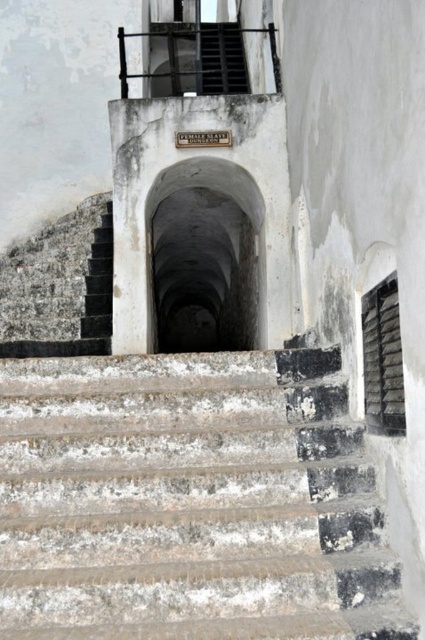
Question: Considering the real-world distances, which object is closest to the rusty metal stairs at center?

Choices:
 (A) worn concrete stairs at center
 (B) black metal balustrade at upper center

Answer: (A)

Question: Can you confirm if worn concrete stairs at center is positioned to the left of rusty metal stairs at center?

Choices:
 (A) no
 (B) yes

Answer: (B)

Question: Is worn concrete stairs at center smaller than black metal balustrade at upper center?

Choices:
 (A) yes
 (B) no

Answer: (A)

Question: Which point is farther to the camera?

Choices:
 (A) (176, 92)
 (B) (379, 572)

Answer: (A)

Question: Does worn concrete stairs at center appear under rusty metal stairs at center?

Choices:
 (A) no
 (B) yes

Answer: (B)

Question: Which object is closer to the camera taking this photo?

Choices:
 (A) rusty metal stairs at center
 (B) worn concrete stairs at center

Answer: (A)